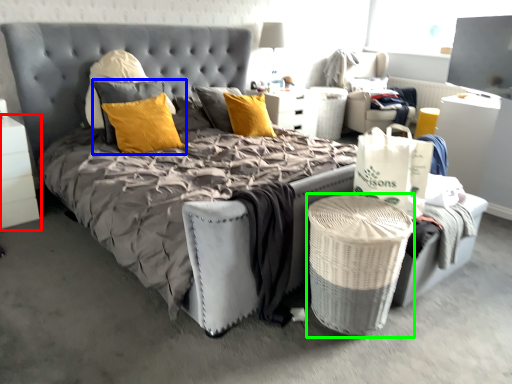
Question: Which object is positioned closest to nightstand (highlighted by a red box)? Select from pillow (highlighted by a blue box) and laundry basket (highlighted by a green box).

Choices:
 (A) pillow
 (B) laundry basket

Answer: (A)